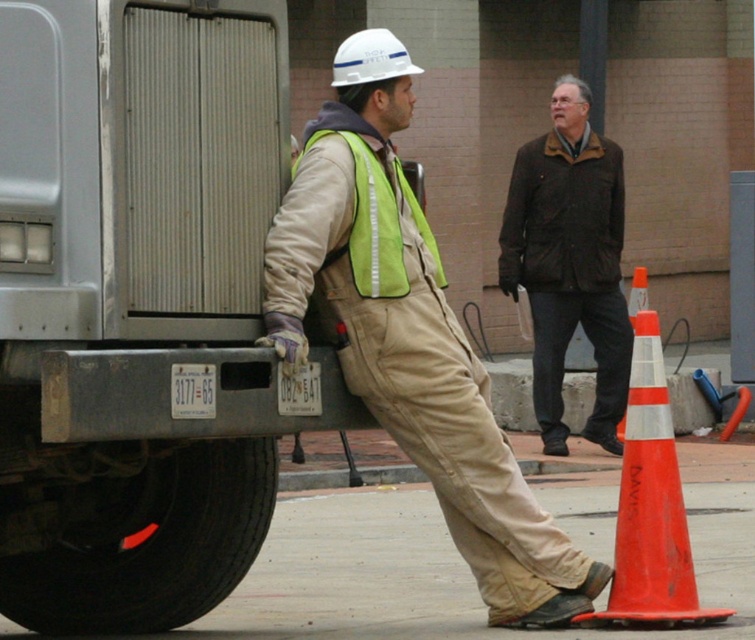
Based on the photo, you are a delivery driver who needs to park your vehicle in a tight space. You see the brushed metal trailer truck at left and the matte khaki overalls at center in the parking area. Which object takes up more space in the parking area?

The matte khaki overalls at center occupies more space than the brushed metal trailer truck at left according to the description.

You are a delivery driver who needs to load a package onto the brushed metal trailer truck at left. You are currently standing near the matte khaki overalls at center. Can you directly access the truck from your current position without moving around any obstacles?

The brushed metal trailer truck at left is closer to the viewer than the matte khaki overalls at center, so yes, you can directly access the truck from your current position without moving around any obstacles.

Looking at this image, you are a safety inspector evaluating the construction site. You notice two workers wearing different clothing items. The first worker has matte khaki overalls at center, and the second has a brown woolen jacket at upper center. Which clothing item is shorter in length?

The matte khaki overalls at center is shorter than the brown woolen jacket at upper center.